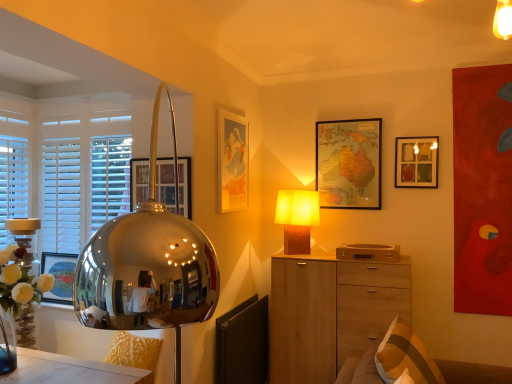
The height and width of the screenshot is (384, 512). What do you see at coordinates (232, 162) in the screenshot?
I see `matte paper poster at upper center, which is counted as the 2th picture frame, starting from the front` at bounding box center [232, 162].

This screenshot has width=512, height=384. In order to click on metallic glass picture frame at upper left, which ranks as the fourth picture frame in right-to-left order in this screenshot , I will do `click(165, 183)`.

Image resolution: width=512 pixels, height=384 pixels. Describe the element at coordinates (82, 189) in the screenshot. I see `white wooden blinds at left` at that location.

You are a GUI agent. You are given a task and a screenshot of the screen. Output one action in this format:
    pyautogui.click(x=<x>, y=<y>)
    Task: Click on the white wooden blinds at left
    The height and width of the screenshot is (384, 512).
    Given the screenshot: What is the action you would take?
    pyautogui.click(x=82, y=189)

Locate an element on the screen. The height and width of the screenshot is (384, 512). wooden chest of drawers at center is located at coordinates (330, 312).

The height and width of the screenshot is (384, 512). I want to click on matte wooden picture frame at upper right, which ranks as the 4th picture frame in left-to-right order, so click(x=416, y=162).

This screenshot has width=512, height=384. Describe the element at coordinates (349, 163) in the screenshot. I see `map paper at upper center, which appears as the 4th picture frame when viewed from the front` at that location.

The height and width of the screenshot is (384, 512). What are the coordinates of `matte paper poster at upper center, which ranks as the 2th picture frame in left-to-right order` in the screenshot? It's located at (232, 162).

Would you say matte wooden picture frame at upper right, which ranks as the 4th picture frame in left-to-right order, is part of beige fabric pillow at lower right's contents?

No, matte wooden picture frame at upper right, which ranks as the 4th picture frame in left-to-right order, is not surrounded by beige fabric pillow at lower right.

Would you say beige fabric pillow at lower right is a long distance from matte wooden picture frame at upper right, the 3th picture frame from the front?

beige fabric pillow at lower right is positioned a significant distance from matte wooden picture frame at upper right, the 3th picture frame from the front.

Which of these two, beige fabric pillow at lower right or matte wooden picture frame at upper right, the 3th picture frame from the front, stands taller?

Standing taller between the two is beige fabric pillow at lower right.

Could you measure the distance between beige fabric pillow at lower right and matte wooden picture frame at upper right, the 2th picture frame viewed from the back?

The distance of beige fabric pillow at lower right from matte wooden picture frame at upper right, the 2th picture frame viewed from the back, is 4.56 feet.

Is matte yellow fabric lampshade at center far away from white wooden blinds at left?

Yes.

Considering the positions of point (295, 227) and point (116, 135), is point (295, 227) closer or farther from the camera than point (116, 135)?

Clearly, point (295, 227) is more distant from the camera than point (116, 135).

Does matte yellow fabric lampshade at center appear on the left side of white wooden blinds at left?

In fact, matte yellow fabric lampshade at center is to the right of white wooden blinds at left.

From a real-world perspective, count 2nd picture frames upward from the white wooden blinds at left and point to it. Please provide its 2D coordinates.

[(416, 162)]

What's the angular difference between matte wooden picture frame at upper right, the 2th picture frame viewed from the back, and white wooden blinds at left's facing directions?

They differ by 1.76 degrees in their facing directions.

Considering the sizes of matte wooden picture frame at upper right, which ranks as the 4th picture frame in left-to-right order, and white wooden blinds at left in the image, is matte wooden picture frame at upper right, which ranks as the 4th picture frame in left-to-right order, bigger or smaller than white wooden blinds at left?

In the image, matte wooden picture frame at upper right, which ranks as the 4th picture frame in left-to-right order, appears to be smaller than white wooden blinds at left.

Could you measure the distance between white wooden blinds at left and metallic glass picture frame at upper left, which is the first picture frame in left-to-right order?

white wooden blinds at left and metallic glass picture frame at upper left, which is the first picture frame in left-to-right order, are 42.10 centimeters apart from each other.

From a real-world perspective, which object rests below the other?

In real-world perspective, metallic glass picture frame at upper left, acting as the fourth picture frame starting from the back, is lower.

In the scene shown: Is white wooden blinds at left looking in the opposite direction of metallic glass picture frame at upper left, which ranks as the fourth picture frame in right-to-left order?

No, white wooden blinds at left is not facing the opposite direction of metallic glass picture frame at upper left, which ranks as the fourth picture frame in right-to-left order.

Does point (70, 234) come closer to viewer compared to point (165, 171)?

No, it is not.

Is metallic gold swivel chair at lower left surrounding matte paper poster at upper center, positioned as the third picture frame in right-to-left order?

No, matte paper poster at upper center, positioned as the third picture frame in right-to-left order, is not surrounded by metallic gold swivel chair at lower left.

From the image's perspective, which is below, metallic gold swivel chair at lower left or matte paper poster at upper center, positioned as the third picture frame in right-to-left order?

From the image's view, metallic gold swivel chair at lower left is below.

Does point (129, 357) lie behind point (219, 111)?

No, it is in front of (219, 111).

Locate an element on the screen. Image resolution: width=512 pixels, height=384 pixels. swivel chair in front of the matte yellow fabric lampshade at center is located at coordinates (134, 351).

Is metallic gold swivel chair at lower left situated inside matte yellow fabric lampshade at center or outside?

metallic gold swivel chair at lower left exists outside the volume of matte yellow fabric lampshade at center.

Can you see metallic gold swivel chair at lower left touching matte yellow fabric lampshade at center?

No, metallic gold swivel chair at lower left is not touching matte yellow fabric lampshade at center.

In the scene shown: Considering the relative sizes of metallic gold swivel chair at lower left and matte yellow fabric lampshade at center in the image provided, is metallic gold swivel chair at lower left wider than matte yellow fabric lampshade at center?

Incorrect, the width of metallic gold swivel chair at lower left does not surpass that of matte yellow fabric lampshade at center.

Is matte yellow fabric lampshade at center shorter than metallic glass picture frame at upper left, which is the first picture frame in left-to-right order?

Incorrect, the height of matte yellow fabric lampshade at center does not fall short of that of metallic glass picture frame at upper left, which is the first picture frame in left-to-right order.

Is point (296, 201) closer to camera compared to point (188, 211)?

No, it is not.

From the image's perspective, is matte yellow fabric lampshade at center located beneath metallic glass picture frame at upper left, acting as the fourth picture frame starting from the back?

Yes, from the image's perspective, matte yellow fabric lampshade at center is below metallic glass picture frame at upper left, acting as the fourth picture frame starting from the back.

Would you consider matte yellow fabric lampshade at center to be distant from metallic glass picture frame at upper left, which is the first picture frame in left-to-right order?

No.

In order to click on pillow in front of the matte wooden picture frame at upper right, the 2th picture frame viewed from the back in this screenshot , I will do `click(405, 356)`.

Locate an element on the screen. This screenshot has height=384, width=512. blind on the left of matte yellow fabric lampshade at center is located at coordinates (82, 189).

When comparing their distances from matte wooden picture frame at upper right, the 3th picture frame from the front, does beige fabric pillow at lower right or metallic glass picture frame at upper left, acting as the fourth picture frame starting from the back, seem closer?

The object closer to matte wooden picture frame at upper right, the 3th picture frame from the front, is beige fabric pillow at lower right.

Estimate the real-world distances between objects in this image. Which object is further from map paper at upper center, which appears as the 4th picture frame when viewed from the front, metallic glass picture frame at upper left, which ranks as the fourth picture frame in right-to-left order, or matte yellow fabric lampshade at center?

Based on the image, metallic glass picture frame at upper left, which ranks as the fourth picture frame in right-to-left order, appears to be further to map paper at upper center, which appears as the 4th picture frame when viewed from the front.

Considering their positions, is metallic glass picture frame at upper left, the 1th picture frame from the front, positioned closer to matte yellow fabric lampshade at center than matte wooden picture frame at upper right, the 3th picture frame from the front?

Based on the image, matte wooden picture frame at upper right, the 3th picture frame from the front, appears to be nearer to matte yellow fabric lampshade at center.

Based on their spatial positions, is matte wooden picture frame at upper right, which ranks as the 4th picture frame in left-to-right order, or beige fabric pillow at lower right closer to map paper at upper center, the 1th picture frame from the back?

matte wooden picture frame at upper right, which ranks as the 4th picture frame in left-to-right order.

Based on their spatial positions, is metallic glass picture frame at upper left, which ranks as the fourth picture frame in right-to-left order, or beige fabric pillow at lower right closer to matte paper poster at upper center, which is counted as the 2th picture frame, starting from the front?

metallic glass picture frame at upper left, which ranks as the fourth picture frame in right-to-left order.

Looking at the image, which one is located further to matte yellow fabric lampshade at center, metallic glass picture frame at upper left, acting as the fourth picture frame starting from the back, or matte paper poster at upper center, which is counted as the 2th picture frame, starting from the front?

The object further to matte yellow fabric lampshade at center is metallic glass picture frame at upper left, acting as the fourth picture frame starting from the back.

Estimate the real-world distances between objects in this image. Which object is further from wooden chest of drawers at center, metallic glass picture frame at upper left, the 1th picture frame from the front, or matte wooden picture frame at upper right, which ranks as the 4th picture frame in left-to-right order?

Based on the image, metallic glass picture frame at upper left, the 1th picture frame from the front, appears to be further to wooden chest of drawers at center.

From the image, which object appears to be farther from matte paper poster at upper center, positioned as the third picture frame in right-to-left order, white wooden blinds at left or wooden chest of drawers at center?

Among the two, wooden chest of drawers at center is located further to matte paper poster at upper center, positioned as the third picture frame in right-to-left order.

You are a GUI agent. You are given a task and a screenshot of the screen. Output one action in this format:
    pyautogui.click(x=<x>, y=<y>)
    Task: Click on the swivel chair between white wooden blinds at left and map paper at upper center, which is the 2th picture frame from right to left, from left to right
    The image size is (512, 384).
    Given the screenshot: What is the action you would take?
    pyautogui.click(x=134, y=351)

Where is `lamp between beige fabric pillow at lower right and matte wooden picture frame at upper right, the 3th picture frame from the front, along the z-axis`? lamp between beige fabric pillow at lower right and matte wooden picture frame at upper right, the 3th picture frame from the front, along the z-axis is located at coordinates (297, 218).

Find the location of `lamp between matte paper poster at upper center, which ranks as the 2th picture frame in left-to-right order, and metallic gold swivel chair at lower left vertically`. lamp between matte paper poster at upper center, which ranks as the 2th picture frame in left-to-right order, and metallic gold swivel chair at lower left vertically is located at coordinates (297, 218).

Image resolution: width=512 pixels, height=384 pixels. Find the location of `lamp between matte paper poster at upper center, which is the third picture frame from back to front, and wooden chest of drawers at center vertically`. lamp between matte paper poster at upper center, which is the third picture frame from back to front, and wooden chest of drawers at center vertically is located at coordinates (297, 218).